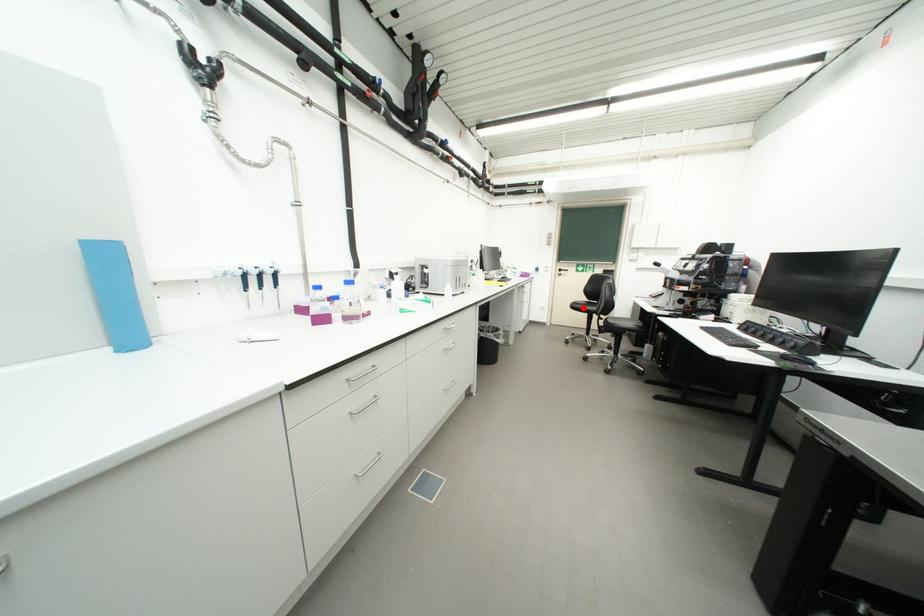
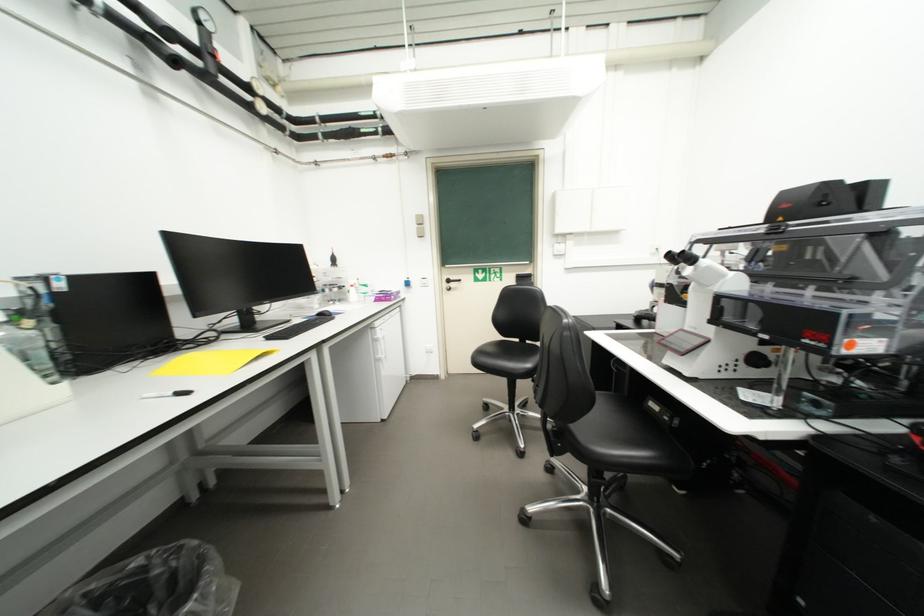
Where in the second image is the point corresponding to the highlighted location from the first image?

(490, 362)